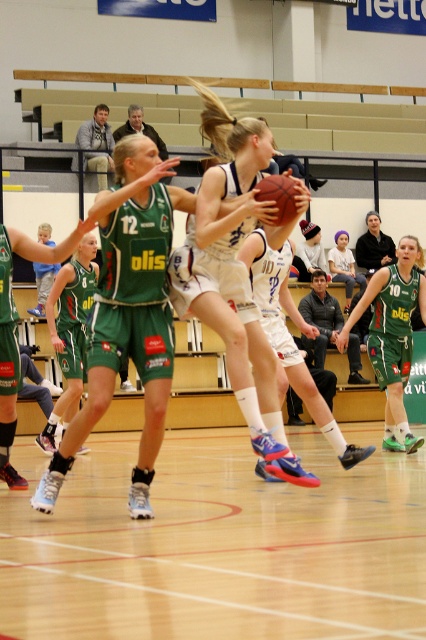
Question: Which point is closer to the camera taking this photo?

Choices:
 (A) (276, 212)
 (B) (408, 348)
 (C) (267, 209)

Answer: (C)

Question: Which of the following is the farthest from the observer?

Choices:
 (A) (278, 205)
 (B) (206, 173)
 (C) (393, 248)
 (D) (400, 243)

Answer: (C)

Question: Is green jersey at center to the right of white jersey at center from the viewer's perspective?

Choices:
 (A) no
 (B) yes

Answer: (B)

Question: Is white matte basketball player at center positioned before rubber textured basketball at center?

Choices:
 (A) no
 (B) yes

Answer: (B)

Question: Estimate the real-world distances between objects in this image. Which object is closer to the dark green jersey at center?

Choices:
 (A) rubber textured basketball at center
 (B) white jersey at center
 (C) white matte basketball player at center
 (D) green jersey at center

Answer: (B)

Question: Does white matte basketball player at center appear on the right side of white jersey at center?

Choices:
 (A) yes
 (B) no

Answer: (B)